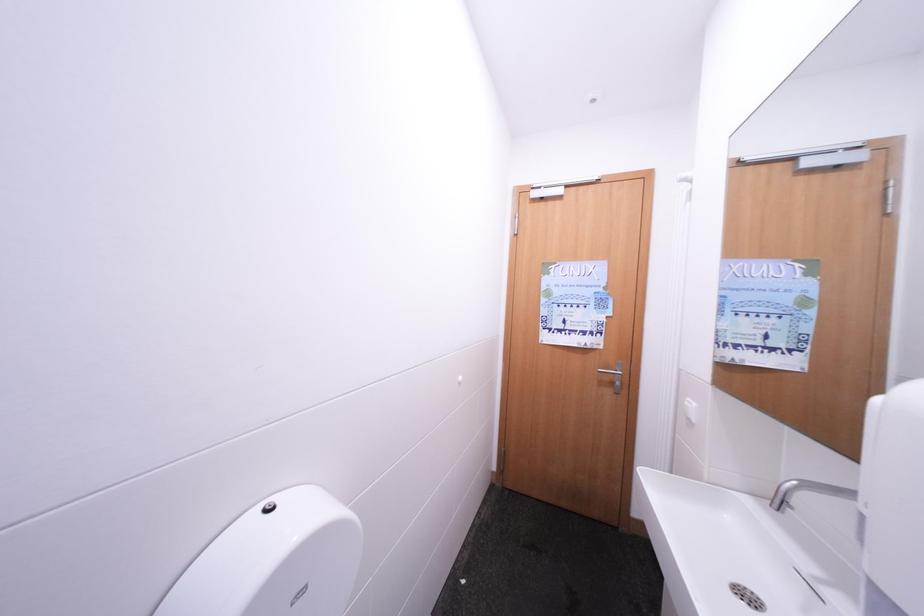
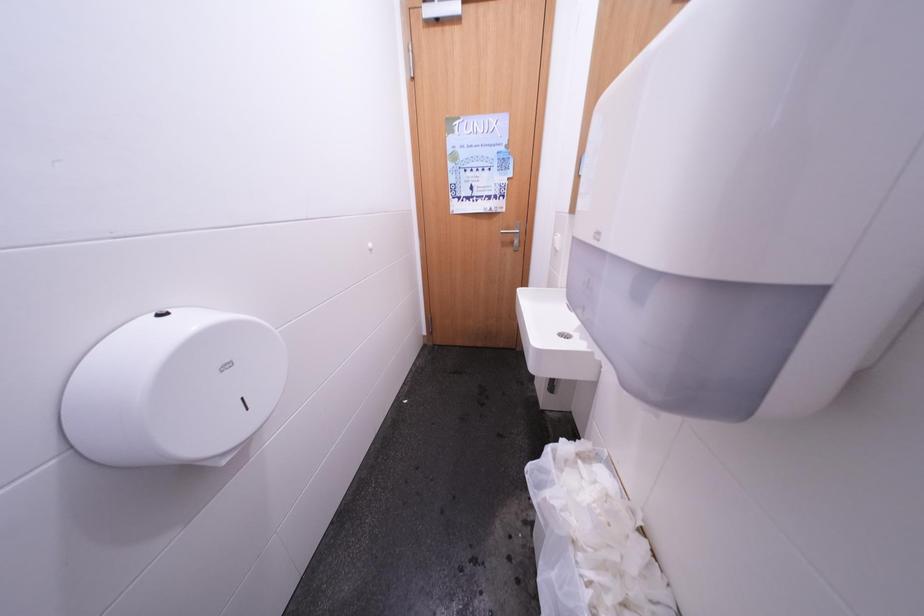
In a continuous first-person perspective shot, in which direction is the camera moving?

The cameraman moved toward right, backward.